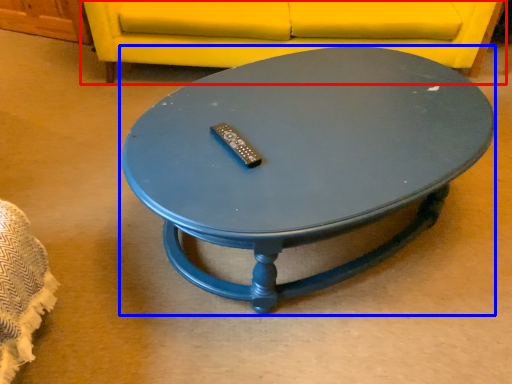
Question: Which object appears farthest to the camera in this image, studio couch (highlighted by a red box) or coffee table (highlighted by a blue box)?

Choices:
 (A) studio couch
 (B) coffee table

Answer: (A)